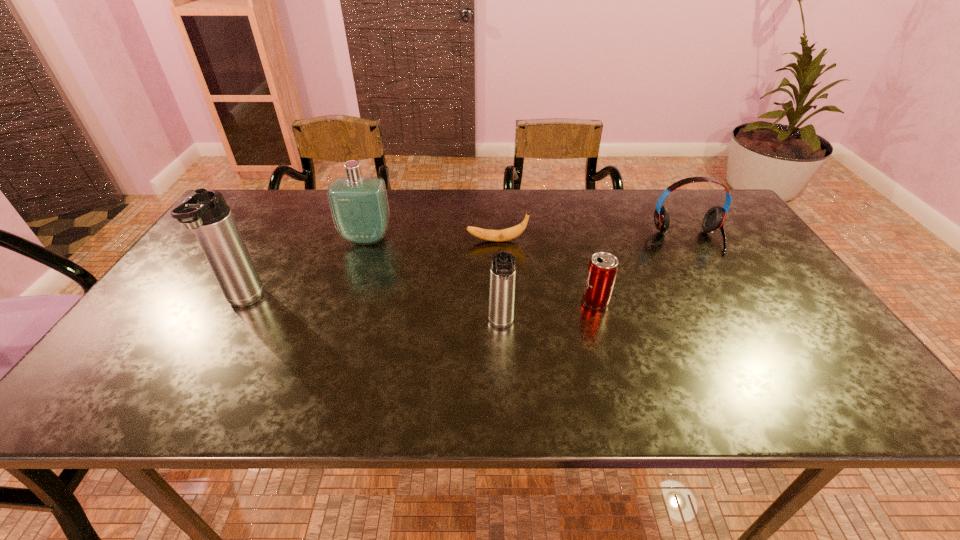
In the image, there is a desktop. Where is `vacant space at the far edge`? This screenshot has width=960, height=540. vacant space at the far edge is located at coordinates (400, 202).

In the image, there is a desktop. Where is `free space at the near edge`? The image size is (960, 540). free space at the near edge is located at coordinates [x=748, y=363].

Where is `vacant region at the left edge of the desktop`? vacant region at the left edge of the desktop is located at coordinates (197, 312).

Image resolution: width=960 pixels, height=540 pixels. I want to click on vacant space at the right edge, so click(732, 246).

The height and width of the screenshot is (540, 960). I want to click on vacant space at the far left corner, so click(285, 198).

Where is `free space between the left thermos bottle and the rightmost object`? Image resolution: width=960 pixels, height=540 pixels. free space between the left thermos bottle and the rightmost object is located at coordinates (466, 272).

Identify the location of free spot between the headset and the second tallest object. This screenshot has width=960, height=540. (527, 239).

Find the location of a particular element. The image size is (960, 540). vacant region between the headset and the fifth object from left to right is located at coordinates (642, 271).

This screenshot has width=960, height=540. Identify the location of vacant space that is in between the beer can and the headset. (642, 271).

In order to click on vacant region between the right thermos bottle and the perfume in this screenshot , I will do `click(434, 282)`.